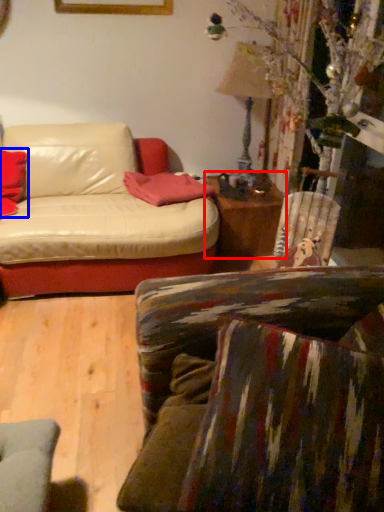
Question: Which of the following is the farthest to the observer, table (highlighted by a red box) or pillow (highlighted by a blue box)?

Choices:
 (A) table
 (B) pillow

Answer: (A)